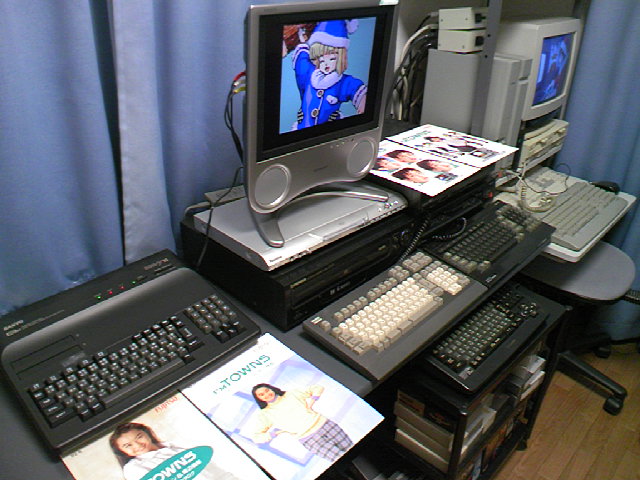
The image size is (640, 480). What are the coordinates of `computer keyboard` in the screenshot? It's located at (395, 302), (573, 215), (484, 242), (488, 332).